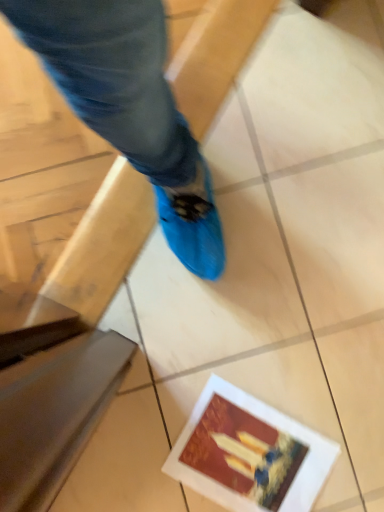
Image resolution: width=384 pixels, height=512 pixels. What are the coordinates of `matte paper postcard at lower right` in the screenshot? It's located at (246, 452).

Describe the element at coordinates (246, 452) in the screenshot. I see `matte paper postcard at lower right` at that location.

From the picture: What is the approximate height of smooth beige tile at lower left?

The height of smooth beige tile at lower left is 5.96 centimeters.

What do you see at coordinates (123, 463) in the screenshot?
I see `smooth beige tile at lower left` at bounding box center [123, 463].

The height and width of the screenshot is (512, 384). In order to click on smooth beige tile at lower left in this screenshot , I will do `click(123, 463)`.

In order to face smooth beige tile at lower left, should I rotate leftwards or rightwards?

It's best to rotate left around 13.422 degrees.

You are a GUI agent. You are given a task and a screenshot of the screen. Output one action in this format:
    pyautogui.click(x=<x>, y=<y>)
    Task: Click on the matte paper postcard at lower right
    Image resolution: width=384 pixels, height=512 pixels.
    Given the screenshot: What is the action you would take?
    pyautogui.click(x=246, y=452)

Considering the relative positions of matte paper postcard at lower right and smooth beige tile at lower left in the image provided, is matte paper postcard at lower right to the left or to the right of smooth beige tile at lower left?

In the image, matte paper postcard at lower right appears on the right side of smooth beige tile at lower left.

Between matte paper postcard at lower right and smooth beige tile at lower left, which one is positioned behind?

matte paper postcard at lower right is behind.

Is point (295, 458) closer or farther from the camera than point (111, 446)?

Clearly, point (295, 458) is more distant from the camera than point (111, 446).

From the image's perspective, is matte paper postcard at lower right located above or below smooth beige tile at lower left?

matte paper postcard at lower right is below smooth beige tile at lower left.

From a real-world perspective, which object rests below the other?

From a 3D spatial view, matte paper postcard at lower right is below.

Considering the relative sizes of matte paper postcard at lower right and smooth beige tile at lower left in the image provided, is matte paper postcard at lower right thinner than smooth beige tile at lower left?

No, matte paper postcard at lower right is not thinner than smooth beige tile at lower left.

From their relative heights in the image, would you say matte paper postcard at lower right is taller or shorter than smooth beige tile at lower left?

Clearly, matte paper postcard at lower right is shorter compared to smooth beige tile at lower left.

Considering the sizes of objects matte paper postcard at lower right and smooth beige tile at lower left in the image provided, who is smaller, matte paper postcard at lower right or smooth beige tile at lower left?

smooth beige tile at lower left is smaller.

Is matte paper postcard at lower right not within smooth beige tile at lower left?

Yes, matte paper postcard at lower right is outside of smooth beige tile at lower left.

Is matte paper postcard at lower right placed right next to smooth beige tile at lower left?

No, matte paper postcard at lower right is not beside smooth beige tile at lower left.

Is matte paper postcard at lower right looking in the opposite direction of smooth beige tile at lower left?

No, smooth beige tile at lower left is not at the back of matte paper postcard at lower right.

Can you tell me how much matte paper postcard at lower right and smooth beige tile at lower left differ in facing direction?

matte paper postcard at lower right and smooth beige tile at lower left are facing 180 degrees away from each other.

How distant is matte paper postcard at lower right from smooth beige tile at lower left?

The distance of matte paper postcard at lower right from smooth beige tile at lower left is 5.03 inches.

The height and width of the screenshot is (512, 384). Identify the location of tile that is above the matte paper postcard at lower right (from a real-world perspective). (123, 463).

Would you say smooth beige tile at lower left is to the left or to the right of matte paper postcard at lower right in the picture?

In the image, smooth beige tile at lower left appears on the left side of matte paper postcard at lower right.

In the image, is smooth beige tile at lower left positioned in front of or behind matte paper postcard at lower right?

Visually, smooth beige tile at lower left is located in front of matte paper postcard at lower right.

Between point (68, 488) and point (245, 405), which one is positioned in front?

The point (68, 488) is more forward.

From the image's perspective, is smooth beige tile at lower left on matte paper postcard at lower right?

Yes.

From the picture: From a real-world perspective, between smooth beige tile at lower left and matte paper postcard at lower right, who is vertically lower?

From a 3D spatial view, matte paper postcard at lower right is below.

Is smooth beige tile at lower left wider or thinner than matte paper postcard at lower right?

Clearly, smooth beige tile at lower left has less width compared to matte paper postcard at lower right.

Considering the relative sizes of smooth beige tile at lower left and matte paper postcard at lower right in the image provided, is smooth beige tile at lower left shorter than matte paper postcard at lower right?

Incorrect, the height of smooth beige tile at lower left does not fall short of that of matte paper postcard at lower right.

Based on their sizes in the image, would you say smooth beige tile at lower left is bigger or smaller than matte paper postcard at lower right?

In the image, smooth beige tile at lower left appears to be smaller than matte paper postcard at lower right.

Is smooth beige tile at lower left inside the boundaries of matte paper postcard at lower right, or outside?

smooth beige tile at lower left is spatially situated outside matte paper postcard at lower right.

Is smooth beige tile at lower left in contact with matte paper postcard at lower right?

There is a gap between smooth beige tile at lower left and matte paper postcard at lower right.

Is smooth beige tile at lower left turned away from matte paper postcard at lower right?

No, smooth beige tile at lower left's orientation is not away from matte paper postcard at lower right.

Where is `postcard below the smooth beige tile at lower left (from the image's perspective)`? This screenshot has height=512, width=384. postcard below the smooth beige tile at lower left (from the image's perspective) is located at coordinates coord(246,452).

You are a GUI agent. You are given a task and a screenshot of the screen. Output one action in this format:
    pyautogui.click(x=<x>, y=<y>)
    Task: Click on the tile located above the matte paper postcard at lower right (from the image's perspective)
    
    Given the screenshot: What is the action you would take?
    pyautogui.click(x=123, y=463)

This screenshot has height=512, width=384. Find the location of `tile that is on the left side of matte paper postcard at lower right`. tile that is on the left side of matte paper postcard at lower right is located at coordinates (123, 463).